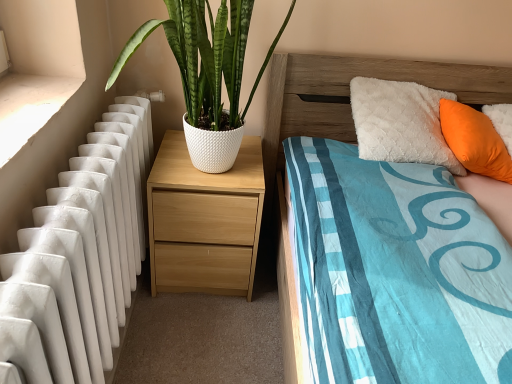
Question: From their relative heights in the image, would you say orange fabric pillow at upper right is taller or shorter than wooden headboard at upper right?

Choices:
 (A) short
 (B) tall

Answer: (A)

Question: Is orange fabric pillow at upper right to the left or to the right of wooden headboard at upper right in the image?

Choices:
 (A) left
 (B) right

Answer: (B)

Question: Estimate the real-world distances between objects in this image. Which object is farther from the white textured pot at left?

Choices:
 (A) light wood/texture nightstand at center
 (B) wooden headboard at upper right
 (C) orange fabric pillow at upper right
 (D) white smooth concrete at left

Answer: (C)

Question: Estimate the real-world distances between objects in this image. Which object is farther from the white textured pot at left?

Choices:
 (A) orange fabric pillow at upper right
 (B) light wood/texture nightstand at center
 (C) white smooth concrete at left
 (D) wooden headboard at upper right

Answer: (A)